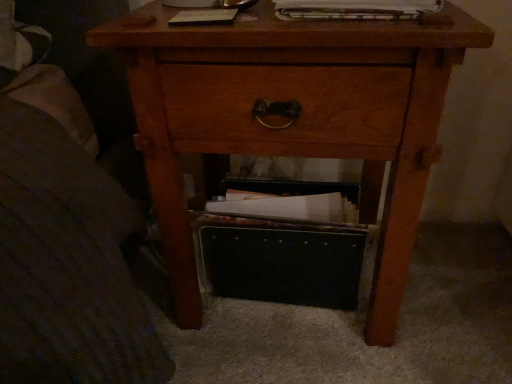
Where is `wooden nightstand at center`? The width and height of the screenshot is (512, 384). wooden nightstand at center is located at coordinates (295, 120).

In order to face black leather shoe box at lower center, should I rotate leftwards or rightwards?

Rotate right and turn 4.615 degrees.

You are a GUI agent. You are given a task and a screenshot of the screen. Output one action in this format:
    pyautogui.click(x=<x>, y=<y>)
    Task: Click on the printed paper magazine at upper center
    The height and width of the screenshot is (384, 512).
    Given the screenshot: What is the action you would take?
    pyautogui.click(x=354, y=9)

Can you confirm if wooden nightstand at center is shorter than black leather shoe box at lower center?

No, wooden nightstand at center is not shorter than black leather shoe box at lower center.

From a real-world perspective, which object rests below the other?

black leather shoe box at lower center, from a real-world perspective.

Where is `nightstand above the black leather shoe box at lower center (from a real-world perspective)`? Image resolution: width=512 pixels, height=384 pixels. nightstand above the black leather shoe box at lower center (from a real-world perspective) is located at coordinates (295, 120).

Which is nearer, (234, 261) or (345, 117)?

Clearly, point (234, 261) is more distant from the camera than point (345, 117).

Considering the sizes of objects black leather shoe box at lower center and wooden nightstand at center in the image provided, who is smaller, black leather shoe box at lower center or wooden nightstand at center?

black leather shoe box at lower center is smaller.

Is the surface of black leather shoe box at lower center in direct contact with wooden nightstand at center?

No, black leather shoe box at lower center is not beside wooden nightstand at center.

Considering the relative sizes of black leather shoe box at lower center and wooden nightstand at center in the image provided, is black leather shoe box at lower center shorter than wooden nightstand at center?

Correct, black leather shoe box at lower center is not as tall as wooden nightstand at center.

Which of these two, wooden nightstand at center or printed paper magazine at upper center, is bigger?

wooden nightstand at center.

Considering the sizes of objects wooden nightstand at center and printed paper magazine at upper center in the image provided, who is thinner, wooden nightstand at center or printed paper magazine at upper center?

With smaller width is printed paper magazine at upper center.

Considering the points (245, 85) and (282, 19), which point is behind, point (245, 85) or point (282, 19)?

Positioned behind is point (245, 85).

Identify the location of nightstand that appears below the printed paper magazine at upper center (from the image's perspective). (295, 120).

Which of these two, printed paper magazine at upper center or wooden nightstand at center, is thinner?

With smaller width is printed paper magazine at upper center.

Which is in front, point (308, 4) or point (366, 42)?

Point (366, 42)

From a real-world perspective, is printed paper magazine at upper center located higher than wooden nightstand at center?

A: Yes, from a real-world perspective, printed paper magazine at upper center is over wooden nightstand at center

Based on the photo, is printed paper magazine at upper center not near black leather shoe box at lower center?

printed paper magazine at upper center is near black leather shoe box at lower center, not far away.

Is point (313, 16) farther from viewer compared to point (273, 285)?

That is False.

Is printed paper magazine at upper center to the left of black leather shoe box at lower center from the viewer's perspective?

In fact, printed paper magazine at upper center is to the right of black leather shoe box at lower center.

Which of these two, printed paper magazine at upper center or black leather shoe box at lower center, stands taller?

black leather shoe box at lower center is taller.

Does black leather shoe box at lower center have a greater width compared to printed paper magazine at upper center?

No.

Who is bigger, black leather shoe box at lower center or printed paper magazine at upper center?

With larger size is black leather shoe box at lower center.

Is black leather shoe box at lower center with printed paper magazine at upper center?

No, black leather shoe box at lower center is not beside printed paper magazine at upper center.

Does black leather shoe box at lower center have a greater height compared to printed paper magazine at upper center?

Yes, black leather shoe box at lower center is taller than printed paper magazine at upper center.

Locate an element on the screen. shoe box beneath the wooden nightstand at center (from a real-world perspective) is located at coordinates (286, 245).

Locate an element on the screen. The image size is (512, 384). shoe box behind the wooden nightstand at center is located at coordinates (286, 245).

When comparing their distances from printed paper magazine at upper center, does black leather shoe box at lower center or wooden nightstand at center seem closer?

Based on the image, wooden nightstand at center appears to be nearer to printed paper magazine at upper center.

From the image, which object appears to be farther from wooden nightstand at center, black leather shoe box at lower center or printed paper magazine at upper center?

printed paper magazine at upper center.

Looking at the image, which one is located closer to black leather shoe box at lower center, wooden nightstand at center or printed paper magazine at upper center?

wooden nightstand at center is positioned closer to the anchor black leather shoe box at lower center.

Looking at this image, from the image, which object appears to be nearer to black leather shoe box at lower center, printed paper magazine at upper center or wooden nightstand at center?

The object closer to black leather shoe box at lower center is wooden nightstand at center.

Consider the image. When comparing their distances from wooden nightstand at center, does printed paper magazine at upper center or black leather shoe box at lower center seem closer?

The object closer to wooden nightstand at center is black leather shoe box at lower center.

Looking at the image, which one is located closer to printed paper magazine at upper center, wooden nightstand at center or black leather shoe box at lower center?

wooden nightstand at center is positioned closer to the anchor printed paper magazine at upper center.

Find the location of a particular element. The image size is (512, 384). nightstand between printed paper magazine at upper center and black leather shoe box at lower center from top to bottom is located at coordinates (295, 120).